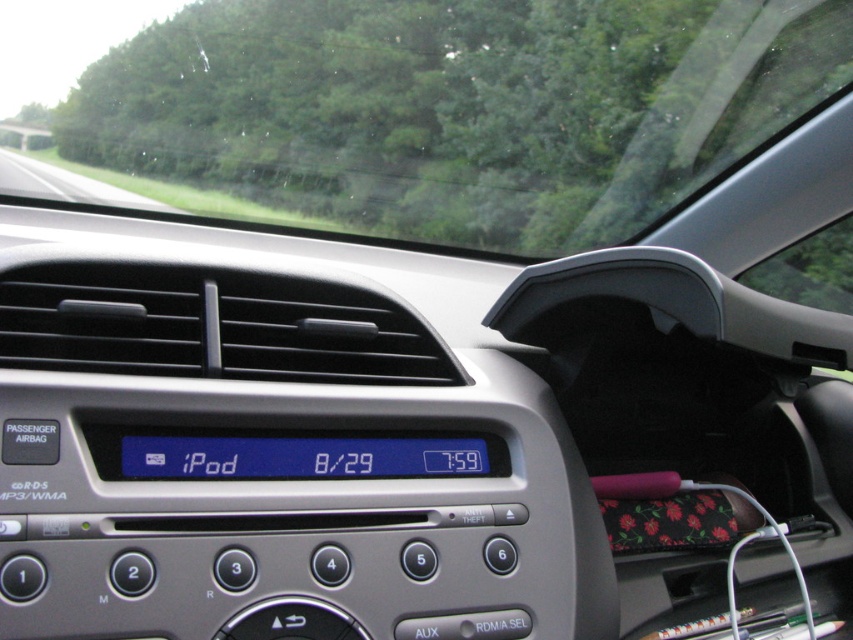
Question: Which of the following is the farthest from the observer?

Choices:
 (A) transparent glass windshield at upper center
 (B) blue lcd display at center

Answer: (A)

Question: Can you confirm if transparent glass windshield at upper center is positioned to the right of blue lcd display at center?

Choices:
 (A) yes
 (B) no

Answer: (B)

Question: Is transparent glass windshield at upper center positioned at the back of blue lcd display at center?

Choices:
 (A) yes
 (B) no

Answer: (A)

Question: Which of the following is the farthest from the observer?

Choices:
 (A) (614, 180)
 (B) (334, 474)

Answer: (A)

Question: Is the position of transparent glass windshield at upper center more distant than that of blue lcd display at center?

Choices:
 (A) yes
 (B) no

Answer: (A)